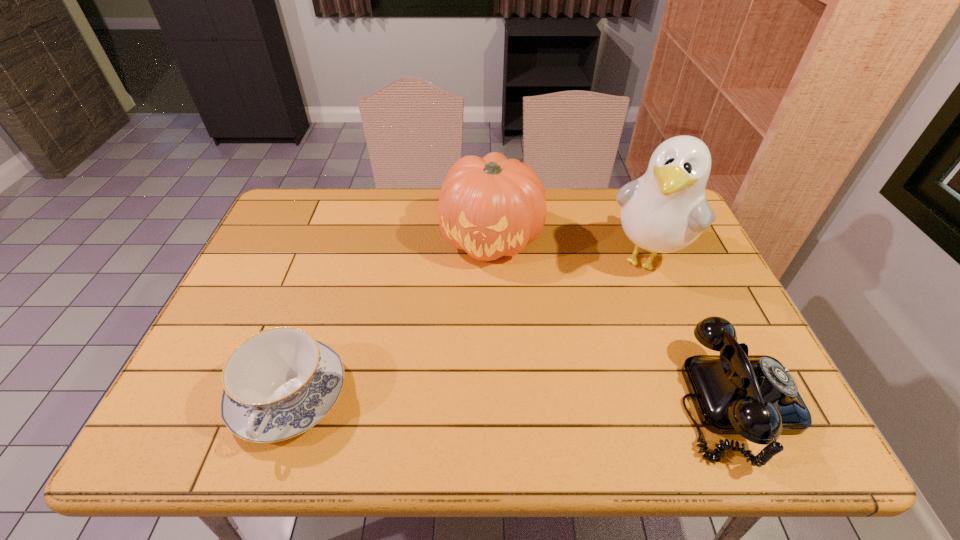
Locate an element on the screen. free space between the third tallest object and the third shortest object is located at coordinates (613, 320).

Locate an element on the screen. blank region between the telephone and the chinaware is located at coordinates (513, 399).

At what (x,y) coordinates should I click in order to perform the action: click on unoccupied area between the telephone and the chinaware. Please return your answer as a coordinate pair (x, y). This screenshot has width=960, height=540. Looking at the image, I should click on (513, 399).

The image size is (960, 540). Identify the location of vacant space in between the second tallest object and the second shortest object. (613, 320).

I want to click on vacant area that lies between the tallest object and the pumpkin, so click(570, 248).

Locate an element on the screen. empty location between the shortest object and the telephone is located at coordinates (513, 399).

I want to click on object that stands as the third closest to the shortest object, so [x=755, y=396].

Identify which object is the third nearest to the pumpkin. Please provide its 2D coordinates. Your answer should be formatted as a tuple, i.e. [(x, y)], where the tuple contains the x and y coordinates of a point satisfying the conditions above.

[(755, 396)]

Identify the location of vacant position in the image that satisfies the following two spatial constraints: 1. with the handle on the side of the third tallest object; 2. on the dial of the shortest object. Image resolution: width=960 pixels, height=540 pixels. (287, 401).

Find the location of a particular element. The image size is (960, 540). free space in the image that satisfies the following two spatial constraints: 1. on the front side of the gull; 2. on the left side of the second object from left to right is located at coordinates (492, 258).